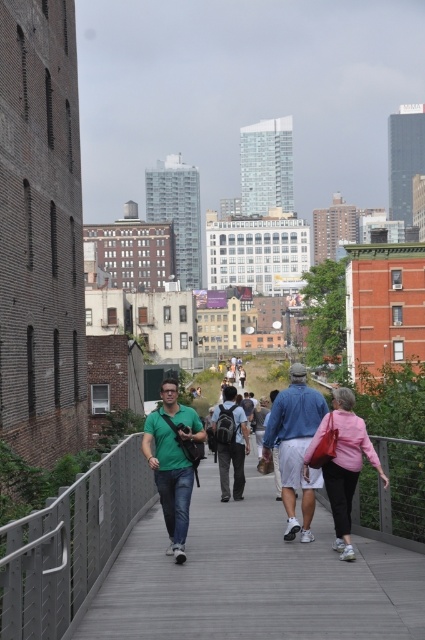
Question: Which point is closer to the camera?

Choices:
 (A) denim shorts at center
 (B) wooden at center
 (C) pink fabric jacket at center

Answer: (B)

Question: Is green matte shirt at center positioned behind denim shorts at center?

Choices:
 (A) no
 (B) yes

Answer: (A)

Question: Which object is closer to the camera taking this photo?

Choices:
 (A) dark blue backpack at center
 (B) denim shorts at center
 (C) wooden at center
 (D) pink fabric jacket at center

Answer: (C)

Question: Does wooden at center have a larger size compared to dark blue backpack at center?

Choices:
 (A) yes
 (B) no

Answer: (A)

Question: Is wooden at center in front of pink fabric jacket at center?

Choices:
 (A) no
 (B) yes

Answer: (B)

Question: Which point is farther to the camera?

Choices:
 (A) (331, 496)
 (B) (285, 465)
 (C) (187, 449)

Answer: (B)